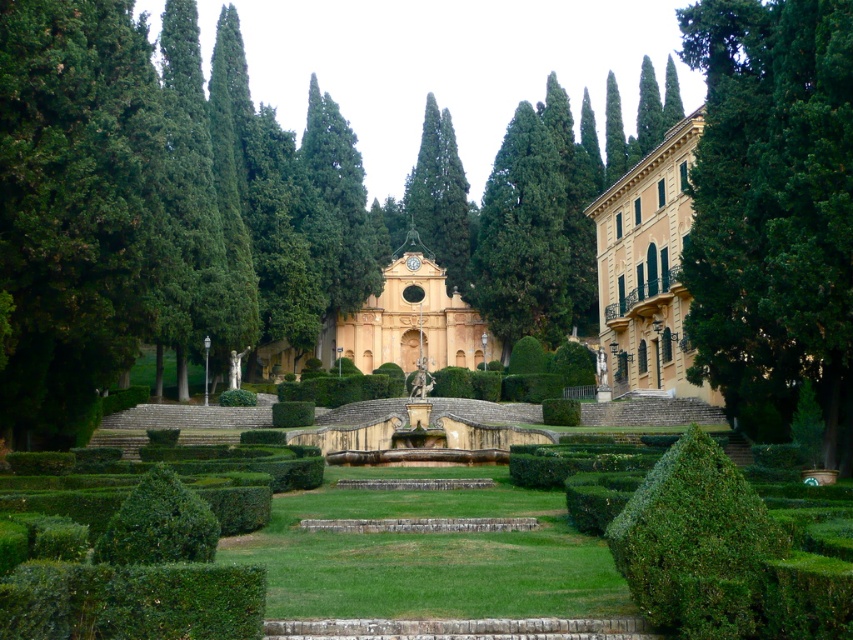
You are standing in the garden and want to take a photo of the green textured tree at center without the green leafy bush at center blocking the view. Is there a way to do this by moving either left or right?

The green leafy bush at center is in front of the green textured tree at center, so moving to the left or right might allow you to position yourself around the bush to capture the tree without obstruction.

You are standing in the garden and want to take a closer look at the green leafy tree at right. If you walk directly towards it, how far will you have to walk?

The green leafy tree at right is 200.34 feet away from the camera, so you will have to walk 200.34 feet to reach it.

You are a landscape architect designing a path that must pass between the green leafy tree at right and the green leafy bush at lower left. Based on their widths, which one might require a narrower path to avoid encroaching on its space?

The green leafy bush at lower left might require a narrower path since it is narrower than the green leafy tree at right, which might be wider according to the description.